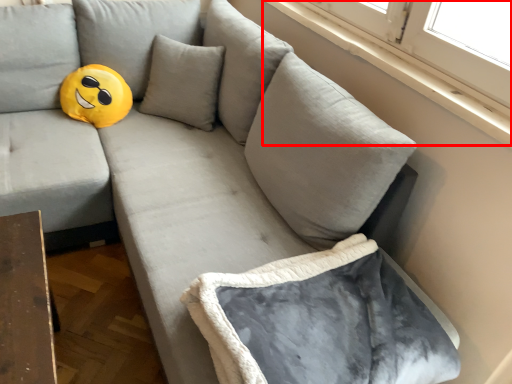
Question: Considering the relative positions of window sill (annotated by the red box) and bean bag chair in the image provided, where is window sill (annotated by the red box) located with respect to the staircase?

Choices:
 (A) right
 (B) left

Answer: (A)